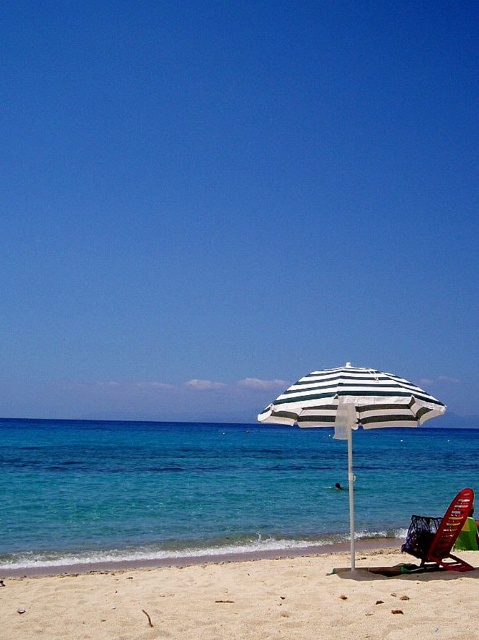
Question: Considering the real-world distances, which object is farthest from the metallic red lounge chair at center?

Choices:
 (A) white striped umbrella at center
 (B) white sand at lower center

Answer: (B)

Question: Does white striped umbrella at center appear on the right side of metallic red lounge chair at center?

Choices:
 (A) no
 (B) yes

Answer: (A)

Question: Estimate the real-world distances between objects in this image. Which object is closer to the white sand at lower center?

Choices:
 (A) metallic red lounge chair at center
 (B) blue water at center

Answer: (A)

Question: Does blue water at center appear on the right side of metallic red lounge chair at center?

Choices:
 (A) yes
 (B) no

Answer: (B)

Question: Does white sand at lower center appear over metallic red lounge chair at center?

Choices:
 (A) yes
 (B) no

Answer: (A)

Question: Which point is closer to the camera?

Choices:
 (A) blue water at center
 (B) white sand at lower center

Answer: (B)